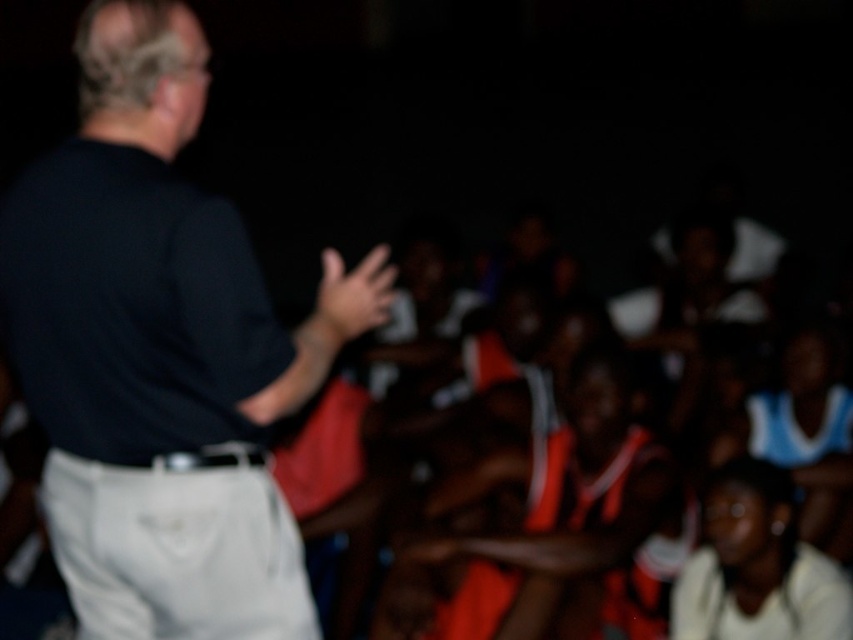
Question: Which of the following is the farthest from the observer?

Choices:
 (A) (717, 500)
 (B) (322, 339)

Answer: (A)

Question: Does white matte shirt at lower right appear under matte black hand at center?

Choices:
 (A) no
 (B) yes

Answer: (B)

Question: Can you confirm if black matte shirt at upper left is positioned above matte black hand at center?

Choices:
 (A) no
 (B) yes

Answer: (A)

Question: Is white matte shirt at lower right wider than matte black hand at center?

Choices:
 (A) no
 (B) yes

Answer: (B)

Question: Which point is closer to the camera taking this photo?

Choices:
 (A) (701, 596)
 (B) (96, 424)

Answer: (B)

Question: Which is nearer to the black matte shirt at upper left?

Choices:
 (A) matte black hand at center
 (B) white matte shirt at lower right

Answer: (A)